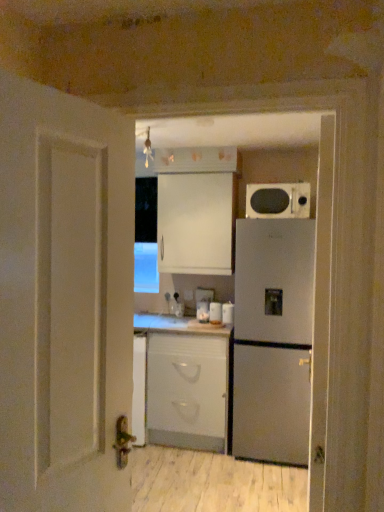
This screenshot has width=384, height=512. I want to click on vacant space that is in between white matte cabinet at center, which ranks as the 2th cabinetry in top-to-bottom order, and satin silver refrigerator at right, so click(x=203, y=458).